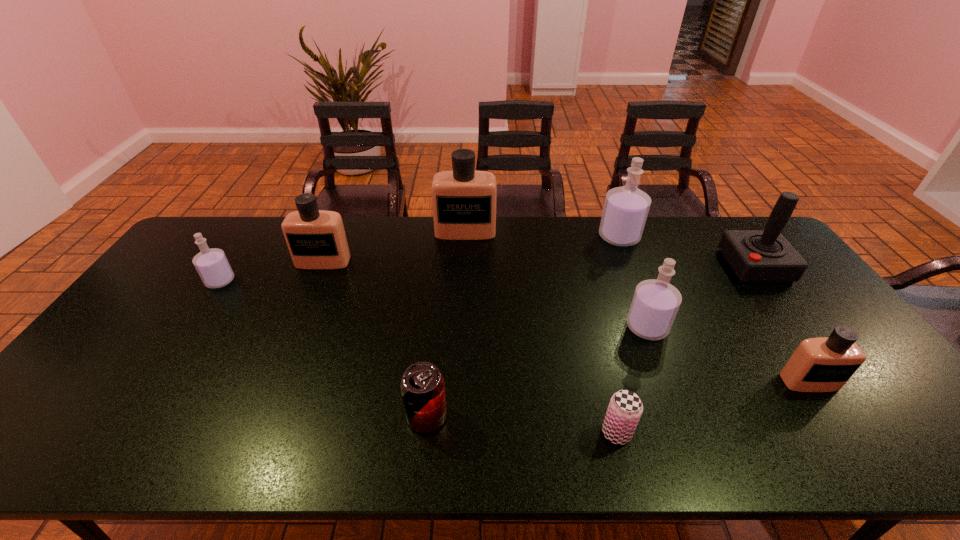
Locate an element on the screen. This screenshot has height=540, width=960. vacant area that lies between the biggest purple perfume and the second beige perfume from right to left is located at coordinates (542, 234).

Locate an element on the screen. This screenshot has height=540, width=960. vacant space that is in between the nearest purple perfume and the beer can is located at coordinates pyautogui.click(x=632, y=380).

What are the coordinates of `free space between the fifth object from right to left and the fourth perfume from right to left` in the screenshot? It's located at click(540, 332).

I want to click on free area in between the third nearest perfume and the joystick, so click(488, 273).

Where is `vacant area between the sixth farthest object and the soda can`? The width and height of the screenshot is (960, 540). vacant area between the sixth farthest object and the soda can is located at coordinates (537, 372).

This screenshot has height=540, width=960. In order to click on vacant space in between the second beige perfume from left to right and the sixth farthest object in this screenshot , I will do `click(556, 279)`.

Identify which object is the second closest to the second farthest beige perfume. Please provide its 2D coordinates. Your answer should be formatted as a tuple, i.e. [(x, y)], where the tuple contains the x and y coordinates of a point satisfying the conditions above.

[(464, 200)]

This screenshot has width=960, height=540. Identify the location of the fourth closest object to the red joystick. (625, 408).

Find the location of `perfume that stands as the second closest to the second perfume from left to right`. perfume that stands as the second closest to the second perfume from left to right is located at coordinates (464, 200).

I want to click on the fourth closest perfume to the farthest purple perfume, so click(x=316, y=239).